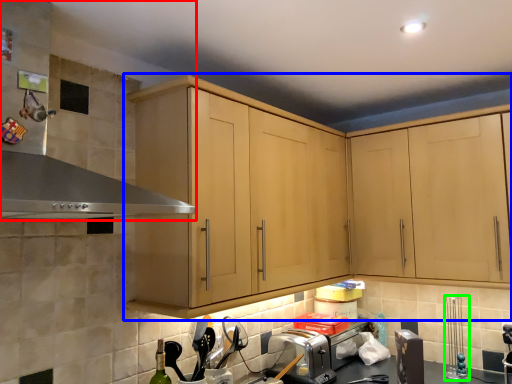
Question: Which object is positioned closest to exhaust hood (highlighted by a red box)? Select from cabinetry (highlighted by a blue box) and appliance (highlighted by a green box).

Choices:
 (A) cabinetry
 (B) appliance

Answer: (A)